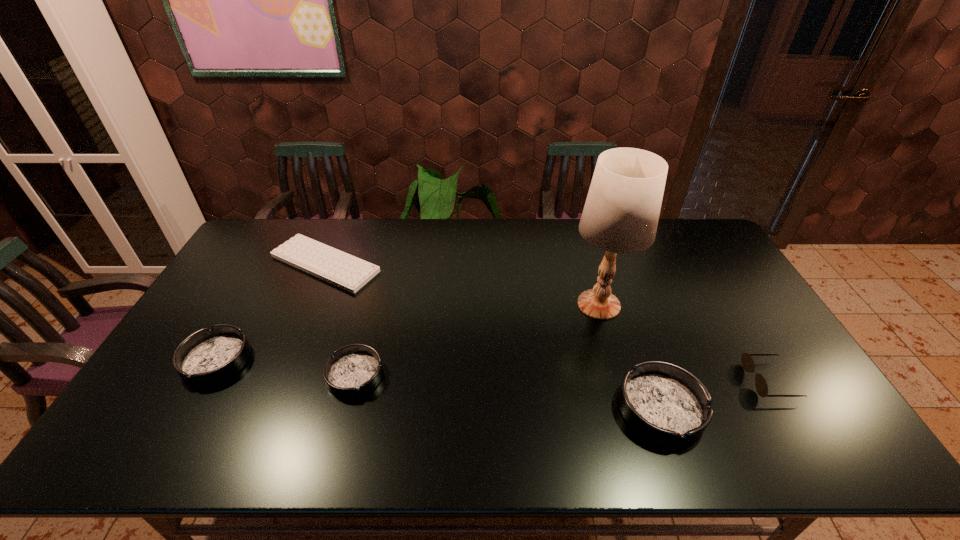
Where is `ashtray that can be found as the closest to the rightmost ashtray`? Image resolution: width=960 pixels, height=540 pixels. ashtray that can be found as the closest to the rightmost ashtray is located at coordinates [354, 370].

Where is `vacant space that satisfies the following two spatial constraints: 1. on the back side of the tallest object; 2. on the right side of the second ashtray from right to left`? The image size is (960, 540). vacant space that satisfies the following two spatial constraints: 1. on the back side of the tallest object; 2. on the right side of the second ashtray from right to left is located at coordinates (373, 305).

Find the location of a particular element. Image resolution: width=960 pixels, height=540 pixels. vacant area that satisfies the following two spatial constraints: 1. on the front side of the rightmost ashtray; 2. on the right side of the second ashtray from right to left is located at coordinates (347, 409).

In order to click on vacant space that satisfies the following two spatial constraints: 1. on the front side of the rightmost ashtray; 2. on the right side of the shortest ashtray in this screenshot , I will do pyautogui.click(x=347, y=409).